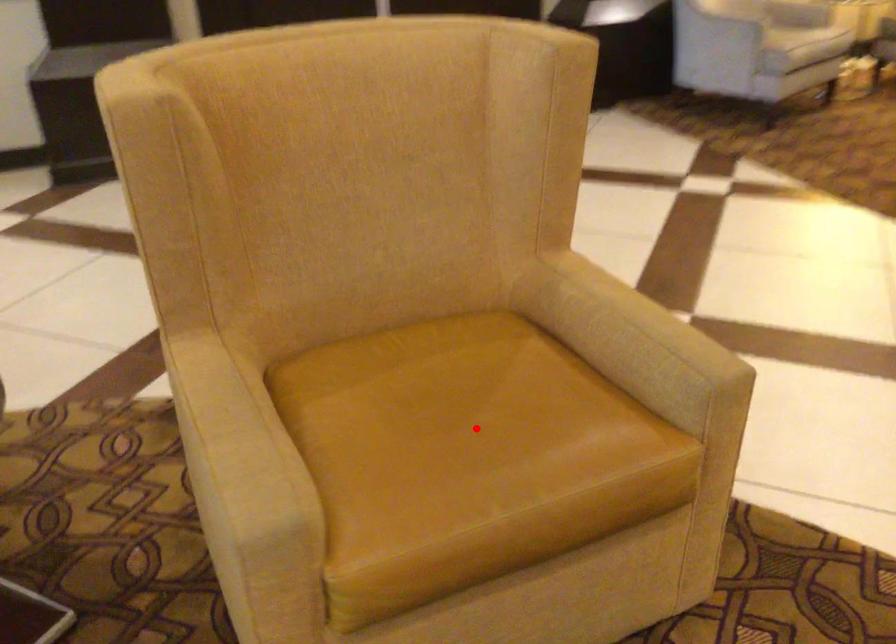
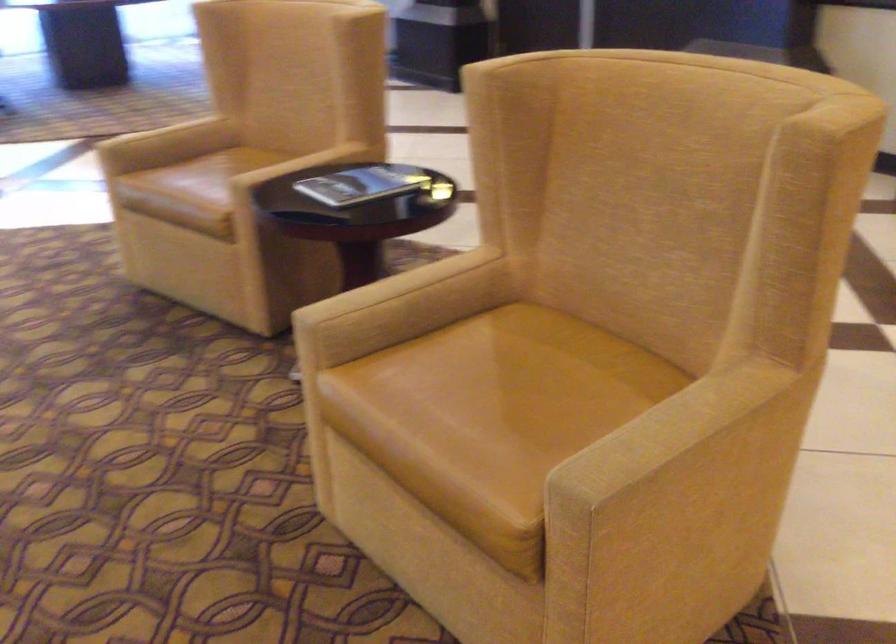
Question: I am providing you with two images of the same scene from different viewpoints. Image1 has a red point marked. In image2, the corresponding 3D location appears at what relative position? Reply with the corresponding letter.

Choices:
 (A) Closer
 (B) Farther

Answer: (B)